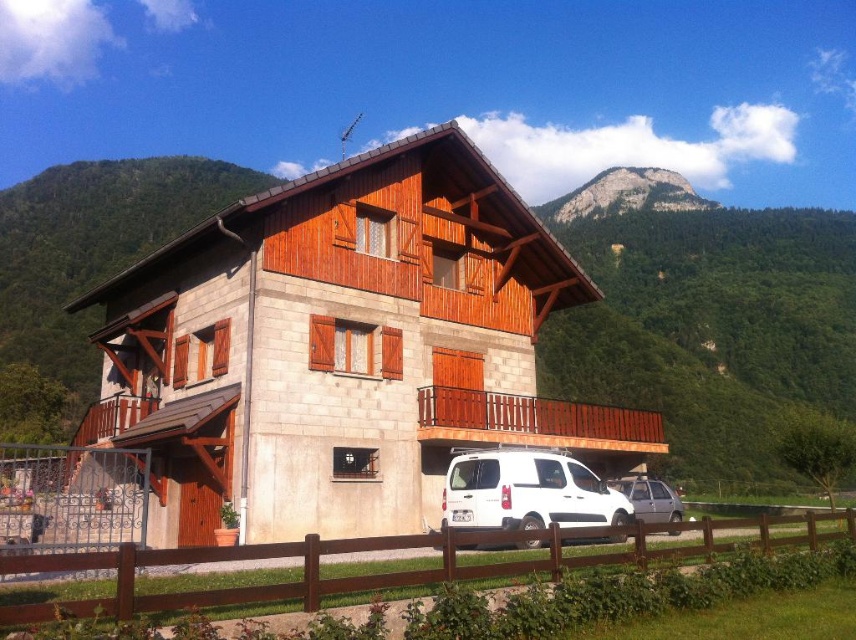
You are standing at the base of the mountain looking at the house. There are two points marked on the house. Which point is closer to you, point (531, 566) or point (522, 516)?

Point (531, 566) is in front of point (522, 516), so it is closer to you.

You are standing at the front yard of the house and want to see the view beyond the brown wooden fence at lower center and the rugged stone mountain at upper center. Which object blocks your view more in terms of height?

The rugged stone mountain at upper center blocks your view more in terms of height since it is taller than the brown wooden fence at lower center.

You are a delivery person approaching the house and see the brown wooden fence at lower center and the white matte van at lower center. Which object is closer to the house?

The brown wooden fence at lower center is closer to the house because it is positioned below the white matte van at lower center, indicating it is nearer in the scene.